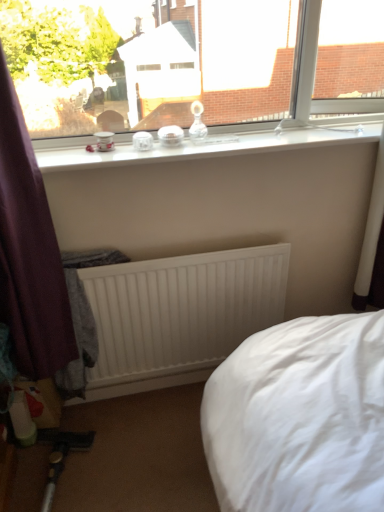
This screenshot has height=512, width=384. I want to click on empty space that is ontop of clear glass jars at upper center (from a real-world perspective), so click(x=254, y=138).